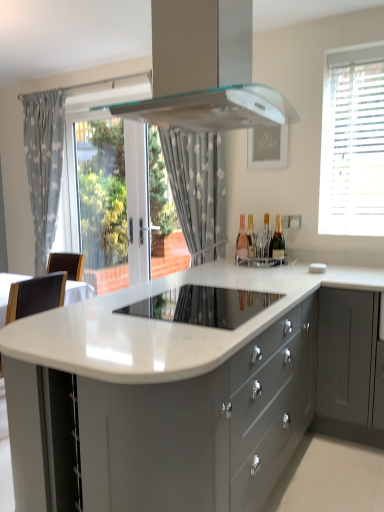
Question: Does point (264, 219) appear closer or farther from the camera than point (38, 117)?

Choices:
 (A) farther
 (B) closer

Answer: (B)

Question: Is matte gold wine bottle at center, arranged as the 2th wine bottle when viewed from the left, in front of or behind gray fabric curtain at left, positioned as the 1th curtain in back-to-front order, in the image?

Choices:
 (A) behind
 (B) front

Answer: (B)

Question: Estimate the real-world distances between objects in this image. Which object is closer to the matte gold wine bottle at center, which ranks as the 3th wine bottle in left-to-right order?

Choices:
 (A) transparent glass door at center
 (B) white blinds at upper right
 (C) white dotted fabric at center, placed as the 1th curtain when sorted from right to left
 (D) high-gloss white cooktop at center
 (E) matte gold wine bottle at center, arranged as the 2th wine bottle when viewed from the left

Answer: (E)

Question: Estimate the real-world distances between objects in this image. Which object is closer to the gray fabric curtain at left, the first curtain viewed from the left?

Choices:
 (A) white blinds at upper right
 (B) matte gold wine bottle at center, which ranks as the 3th wine bottle in left-to-right order
 (C) white glossy countertop at center
 (D) matte glass wine bottle at center, marked as the third wine bottle in a right-to-left arrangement
 (E) transparent glass door at center

Answer: (E)